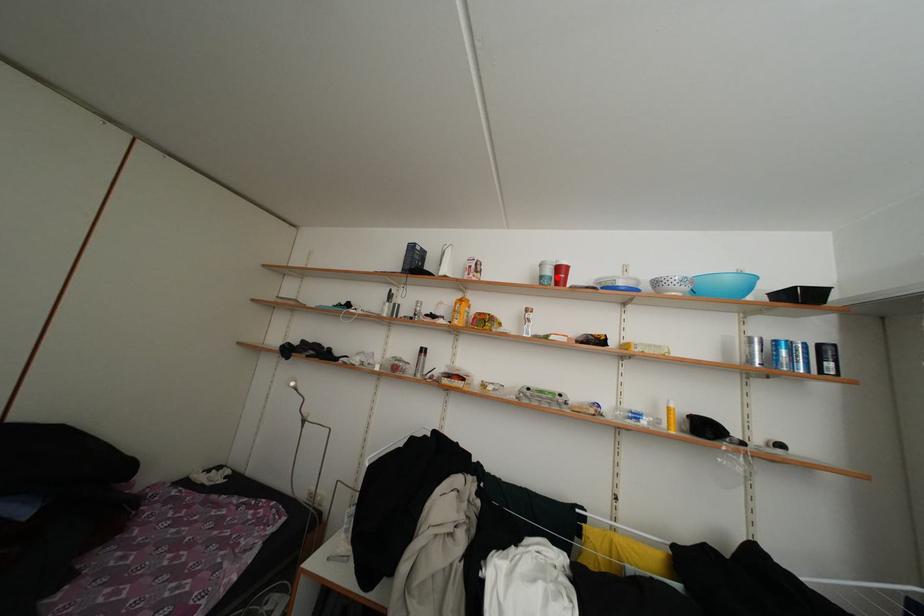
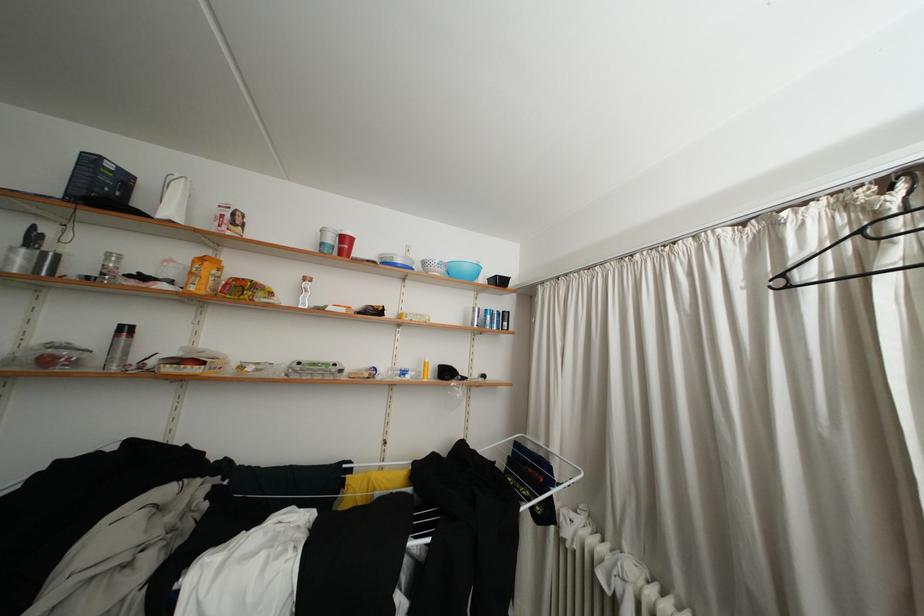
In the second image, find the point that corresponds to the highlighted location in the first image.

(338, 245)